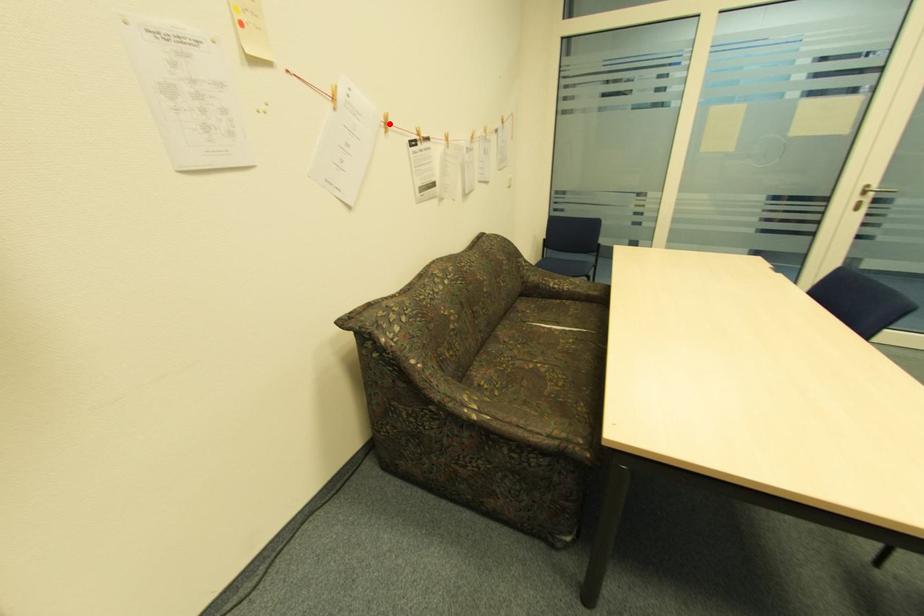
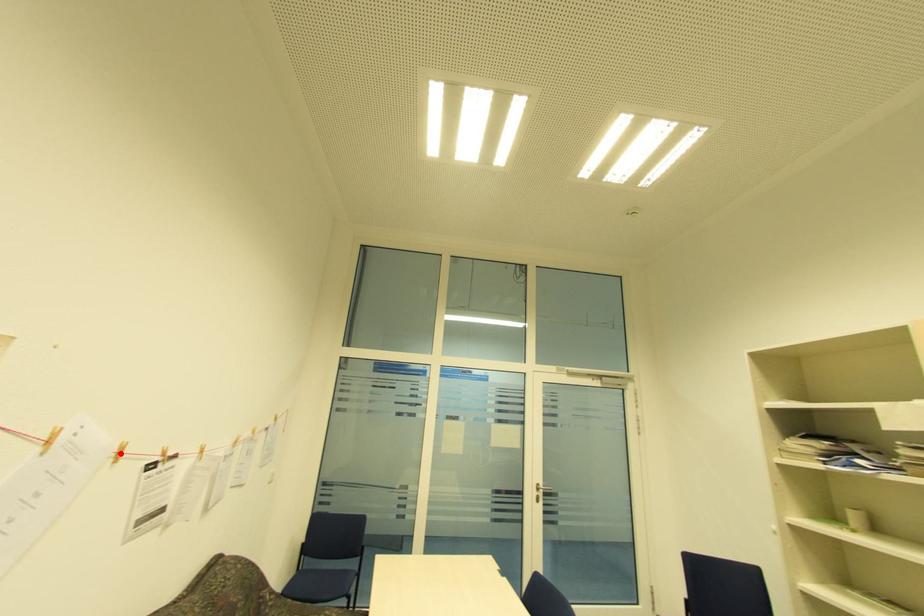
I am providing you with two images of the same scene from different viewpoints. A red point is marked on the first image and another point is marked on the second image. Does the point marked in image1 correspond to the same location as the one in image2?

Yes